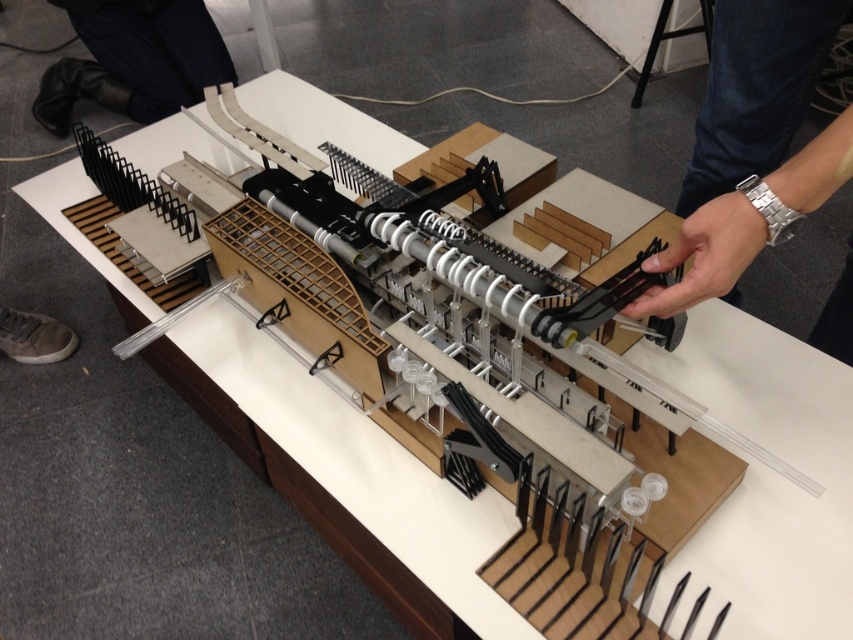
You are an architect examining the model and need to locate a specific point for adjustments. The point you need is at coordinates point (752, 144). Where exactly is this point located on the model?

The point (752, 144) is located on the silver metallic wristwatch at upper right.

You are an architect examining the architectural model. You notice the silver metallic wristwatch at upper right and the black leather pants at upper left. Which object is taller in the model?

The silver metallic wristwatch at upper right is taller than the black leather pants at upper left.